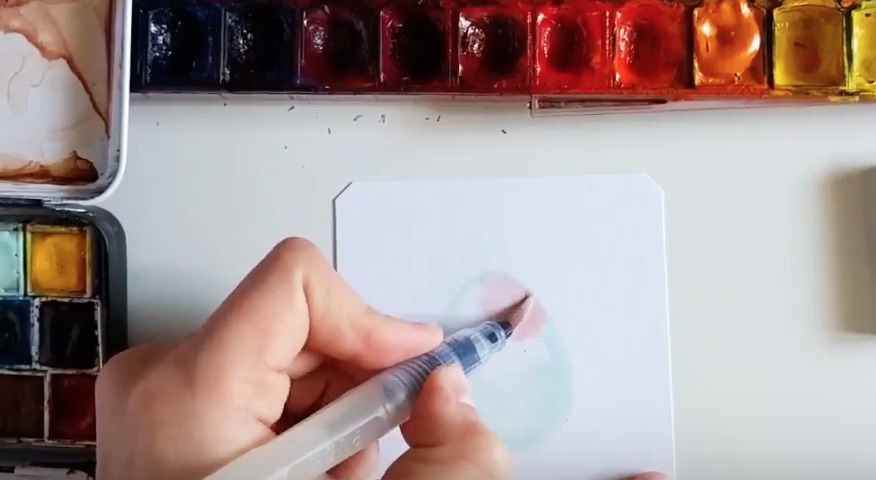
You are a GUI agent. You are given a task and a screenshot of the screen. Output one action in this format:
    pyautogui.click(x=<x>, y=<y>)
    Task: Click on the yellow paint
    
    Given the screenshot: What is the action you would take?
    pyautogui.click(x=795, y=56)